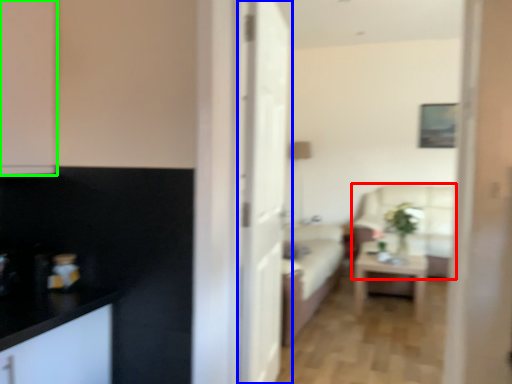
Question: Based on their relative distances, which object is farther from armchair (highlighted by a red box)? Choose from door (highlighted by a blue box) and cabinetry (highlighted by a green box).

Choices:
 (A) door
 (B) cabinetry

Answer: (B)